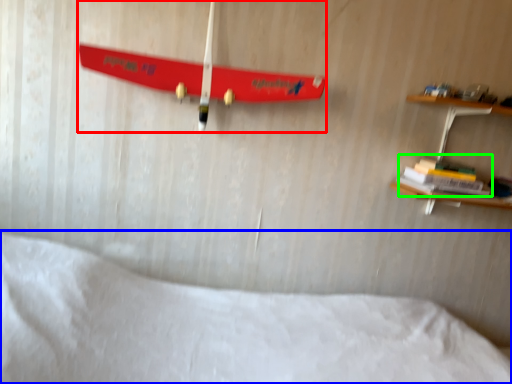
Question: Which object is positioned farthest from skateboard (highlighted by a red box)? Select from bed (highlighted by a blue box) and book (highlighted by a green box).

Choices:
 (A) bed
 (B) book

Answer: (B)